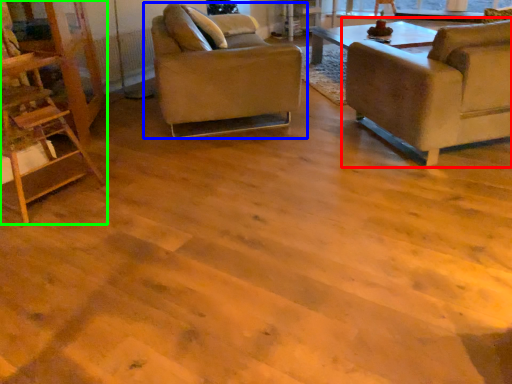
Question: Which object is positioned closest to chair (highlighted by a red box)? Select from chair (highlighted by a blue box) and ladder (highlighted by a green box).

Choices:
 (A) chair
 (B) ladder

Answer: (A)